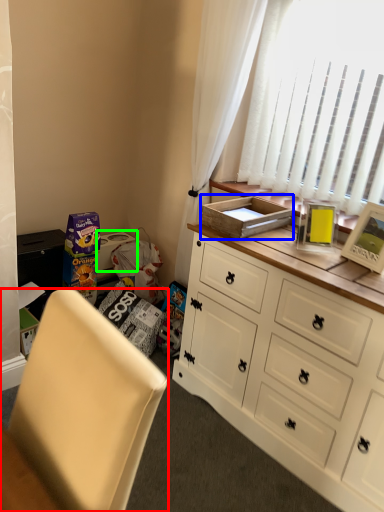
Question: Based on their relative distances, which object is nearer to chair (highlighted by a red box)? Choose from cardboard box (highlighted by a blue box) and box (highlighted by a green box).

Choices:
 (A) cardboard box
 (B) box

Answer: (A)